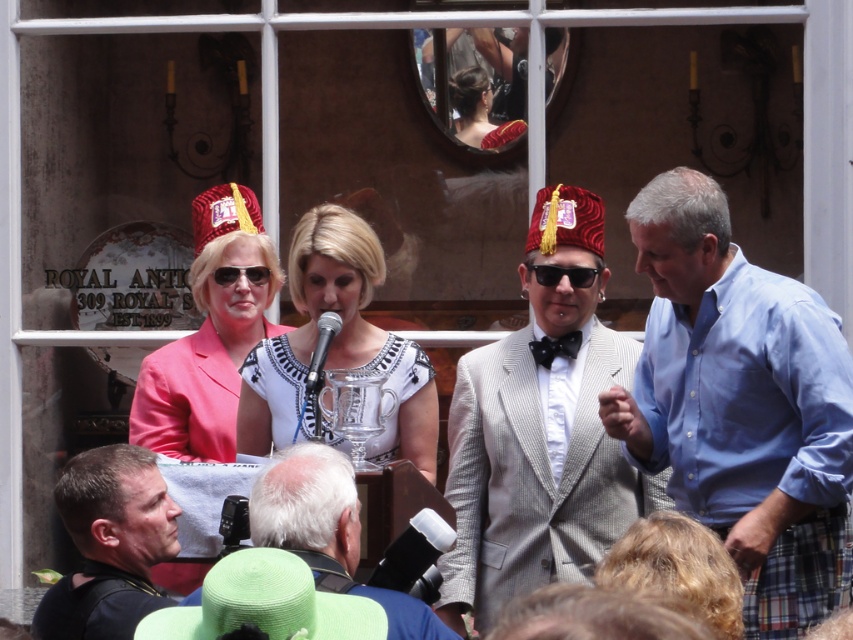
You are standing at the podium where the woman is speaking. You need to pass a message to the person wearing the pink fabric hat at upper left and the blue cotton shirt at right. Which direction should you look to first to ensure both are in your line of sight?

You should look towards the pink fabric hat at upper left first because it is closer to the podium than the blue cotton shirt at right, which is further away. Since the pink fabric hat at upper left is only 20.50 feet away from the blue cotton shirt at right, you can see both by first facing the pink fabric hat at upper left and then the blue cotton shirt at right.

You are a photographer at the event and need to capture a photo that includes both the gray textured suit at lower center and the black plastic goggles at center. Based on their positions, which object should you focus on first to ensure both are in the frame?

The gray textured suit at lower center is positioned under the black plastic goggles at center, so focusing on the goggles first and adjusting the camera angle slightly downward will ensure both are included in the photo.